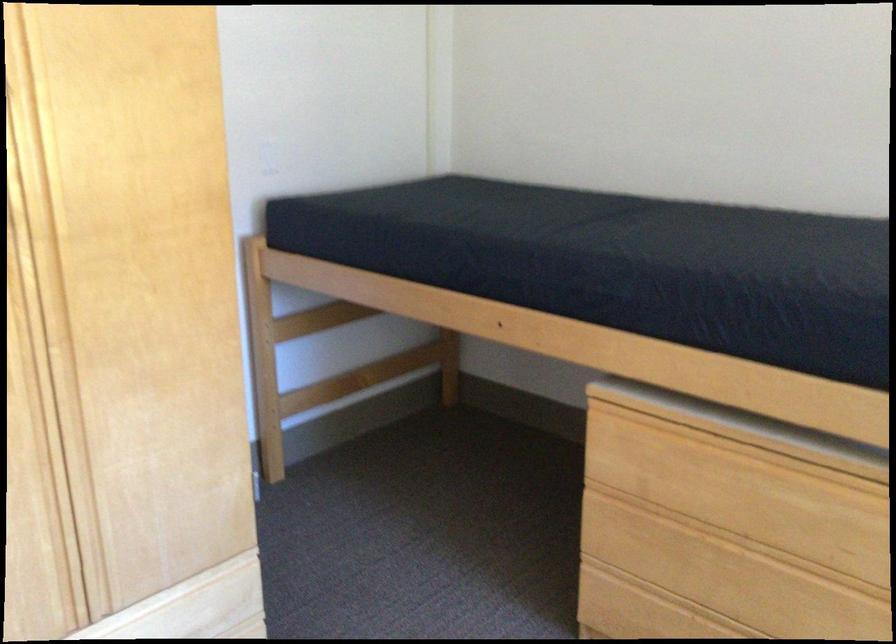
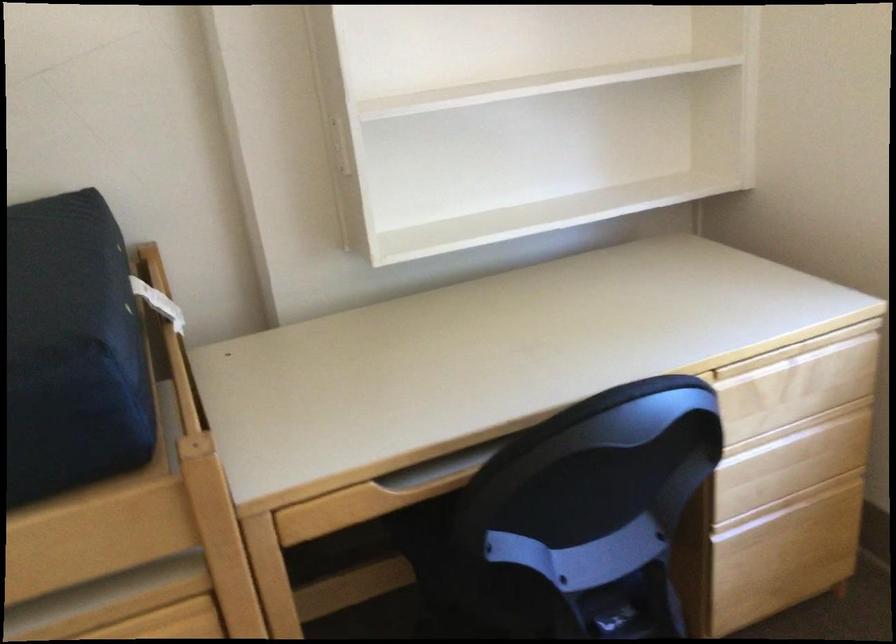
Question: The camera is either moving clockwise (left) or counter-clockwise (right) around the object. The first image is from the beginning of the video and the second image is from the end. Is the camera moving left or right when shooting the video?

Choices:
 (A) Left
 (B) Right

Answer: (A)